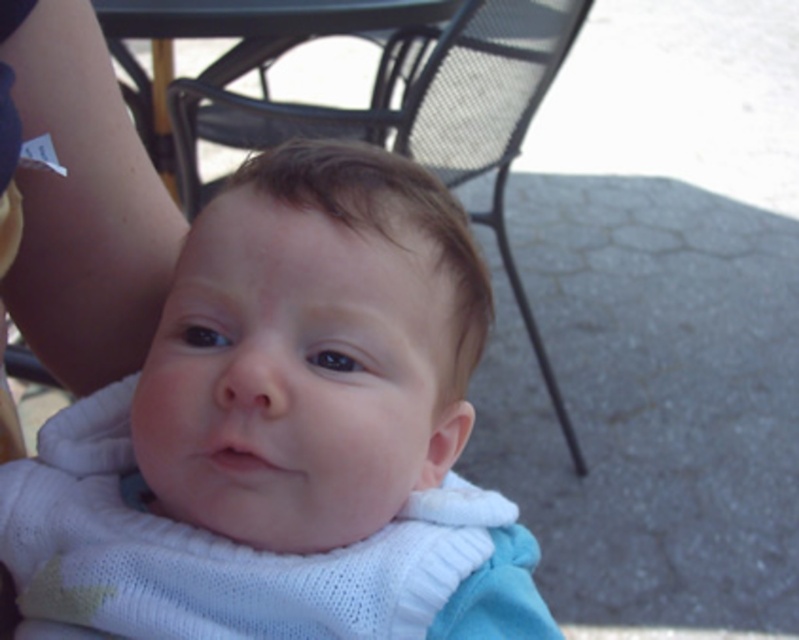
You are a photographer setting up for a baby photo shoot. You need to ensure the baby stays in frame while the person holding them moves slightly. The white knitted baby at center and the black mesh chair at upper center are in the scene. Which object should you focus on to keep the baby in the frame as the holder moves?

The white knitted baby at center is positioned under the black mesh chair at upper center, so focusing on the black mesh chair at upper center will help keep the baby in frame as the holder moves, since the baby is located beneath it.

You are a photographer trying to capture a close shot of the baby. The camera requires a minimum distance of 15 centimeters between the subject and the lens to focus properly. Given the current position of the white knitted baby at center and the skinny white arm at upper left, can you focus on the baby without moving the arm?

The white knitted baby at center is 17.72 centimeters away from the skinny white arm at upper left. Since the minimum focusing distance is 15 centimeters, the camera can focus on the baby without moving the arm as the distance is sufficient.